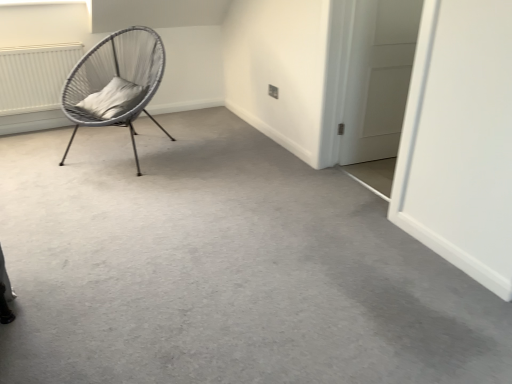
Where is `free space above white textured radiator at upper left (from a real-world perspective)`? The width and height of the screenshot is (512, 384). free space above white textured radiator at upper left (from a real-world perspective) is located at coordinates (37, 38).